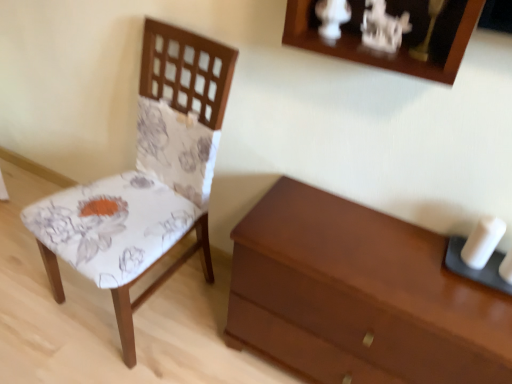
The image size is (512, 384). What are the coordinates of `vacant space positioned to the left of white matte candle at right` in the screenshot? It's located at (407, 249).